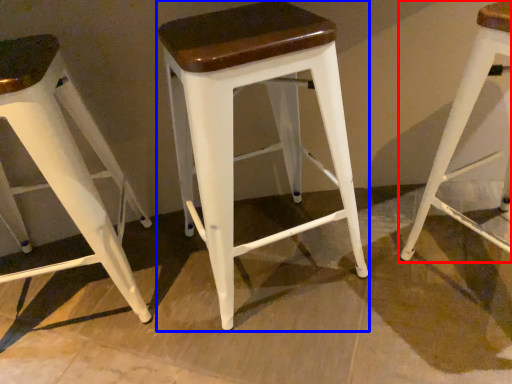
Question: Which object appears closest to the camera in this image, stool (highlighted by a red box) or stool (highlighted by a blue box)?

Choices:
 (A) stool
 (B) stool

Answer: (A)